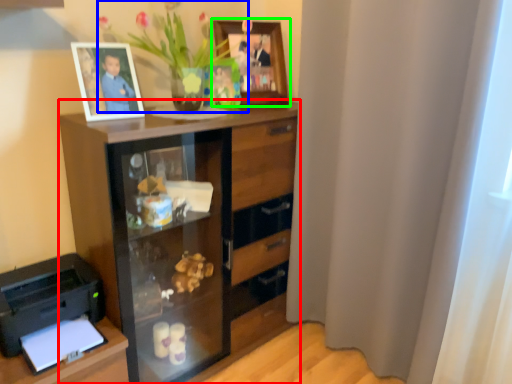
Question: Estimate the real-world distances between objects in this image. Which object is closer to chest of drawers (highlighted by a red box), floral arrangement (highlighted by a blue box) or picture frame (highlighted by a green box)?

Choices:
 (A) floral arrangement
 (B) picture frame

Answer: (A)